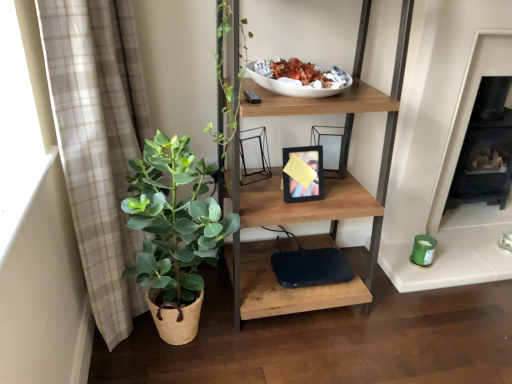
Question: From a real-world perspective, does wooden shelf at center sit lower than beige plaid curtain at left?

Choices:
 (A) no
 (B) yes

Answer: (A)

Question: Is wooden shelf at center positioned far away from beige plaid curtain at left?

Choices:
 (A) yes
 (B) no

Answer: (B)

Question: Is wooden shelf at center turned away from beige plaid curtain at left?

Choices:
 (A) no
 (B) yes

Answer: (A)

Question: Does wooden shelf at center lie behind beige plaid curtain at left?

Choices:
 (A) no
 (B) yes

Answer: (B)

Question: Considering the relative sizes of wooden shelf at center and beige plaid curtain at left in the image provided, is wooden shelf at center taller than beige plaid curtain at left?

Choices:
 (A) yes
 (B) no

Answer: (A)

Question: In terms of width, does black matte fireplace at right look wider or thinner when compared to green leafy plant in woven basket at left?

Choices:
 (A) thin
 (B) wide

Answer: (B)

Question: From the image's perspective, is black matte fireplace at right positioned above or below green leafy plant in woven basket at left?

Choices:
 (A) above
 (B) below

Answer: (A)

Question: Looking at the image, does black matte fireplace at right seem bigger or smaller compared to green leafy plant in woven basket at left?

Choices:
 (A) big
 (B) small

Answer: (A)

Question: Is black matte fireplace at right in front of or behind green leafy plant in woven basket at left in the image?

Choices:
 (A) behind
 (B) front

Answer: (A)

Question: Is black matte fireplace at right to the left or to the right of wooden shelf at center in the image?

Choices:
 (A) right
 (B) left

Answer: (A)

Question: From a real-world perspective, relative to wooden shelf at center, is black matte fireplace at right vertically above or below?

Choices:
 (A) above
 (B) below

Answer: (B)

Question: In terms of height, does black matte fireplace at right look taller or shorter compared to wooden shelf at center?

Choices:
 (A) short
 (B) tall

Answer: (A)

Question: Do you think black matte fireplace at right is within wooden shelf at center, or outside of it?

Choices:
 (A) outside
 (B) inside

Answer: (A)

Question: Looking at their shapes, would you say green leafy plant in woven basket at left is wider or thinner than wooden shelf at center?

Choices:
 (A) thin
 (B) wide

Answer: (A)

Question: From a real-world perspective, is green leafy plant in woven basket at left above or below wooden shelf at center?

Choices:
 (A) above
 (B) below

Answer: (B)